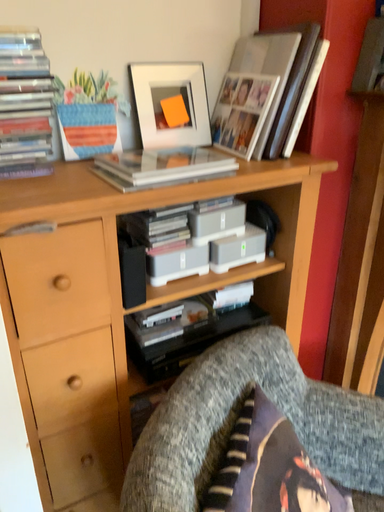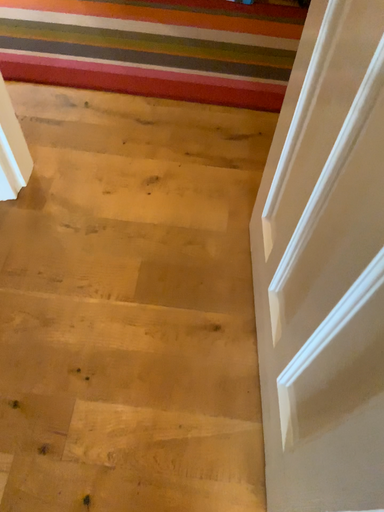
Question: How did the camera likely rotate when shooting the video?

Choices:
 (A) rotated downward
 (B) rotated upward

Answer: (A)